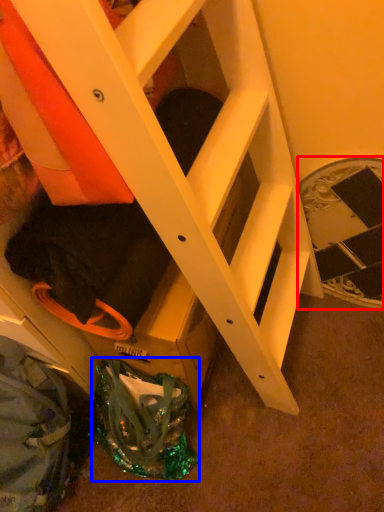
Question: Which point is closer to the camera, stairwell (highlighted by a red box) or bag (highlighted by a blue box)?

Choices:
 (A) stairwell
 (B) bag

Answer: (B)